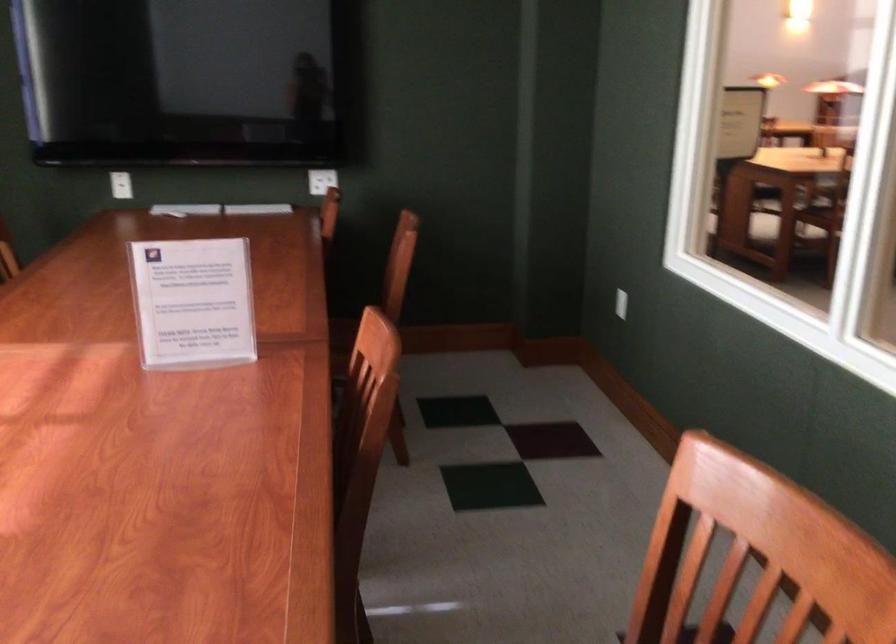
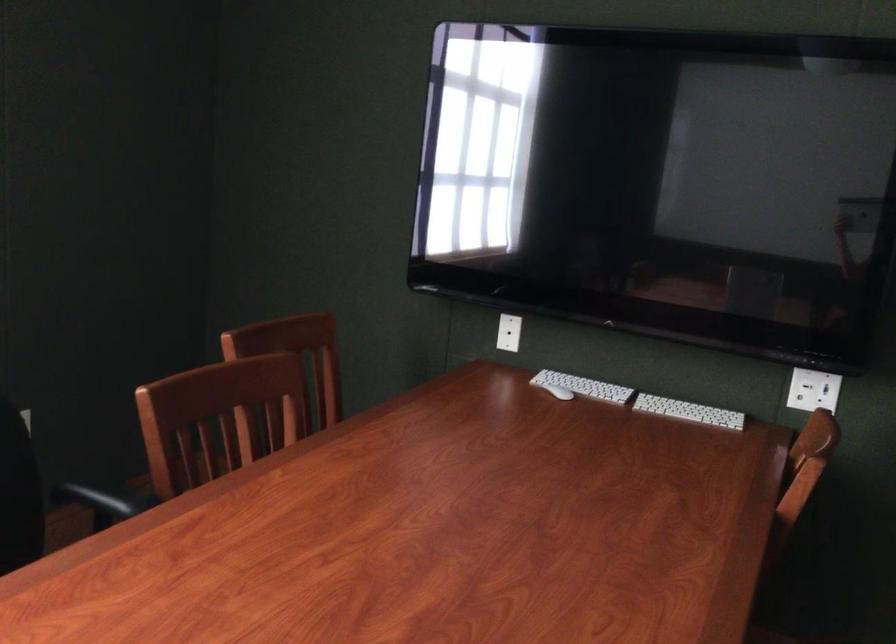
Locate, in the second image, the point that corresponds to pixel 192 205 in the first image.

(583, 386)